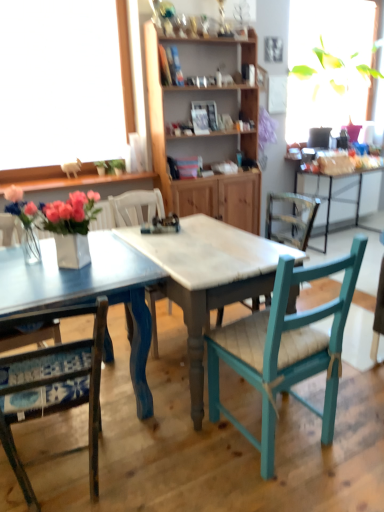
Question: In terms of size, does wooden cabinet at center appear bigger or smaller than blue painted wood table at center?

Choices:
 (A) small
 (B) big

Answer: (B)

Question: From the image's perspective, relative to blue painted wood table at center, is wooden cabinet at center above or below?

Choices:
 (A) below
 (B) above

Answer: (B)

Question: Estimate the real-world distances between objects in this image. Which object is farther from the blue fabric cushioned chair at lower left, the 1th chair in the left-to-right sequence?

Choices:
 (A) white marble table at center
 (B) blue painted wood table at center
 (C) wooden cabinet at center
 (D) white glossy vase at center
 (E) teal wood chair at center, the 1th chair viewed from the right

Answer: (C)

Question: Which of these objects is positioned farthest from the white marble table at center?

Choices:
 (A) white glossy vase at center
 (B) blue painted wood table at center
 (C) wooden cabinet at center
 (D) teal wood chair at center, the third chair when ordered from left to right
 (E) blue fabric cushioned chair at lower left, the 1th chair in the left-to-right sequence

Answer: (C)